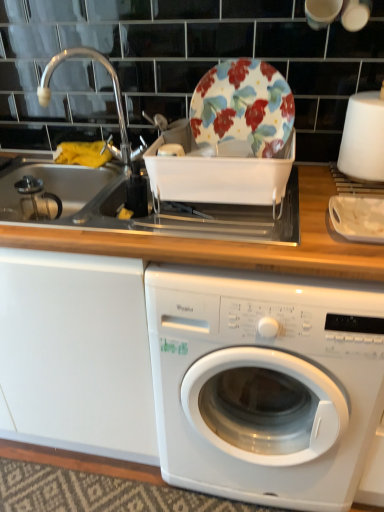
Question: Is brushed metal sink at left bigger than white glossy washing machine at center?

Choices:
 (A) yes
 (B) no

Answer: (B)

Question: From a real-world perspective, is brushed metal sink at left positioned over white glossy washing machine at center based on gravity?

Choices:
 (A) no
 (B) yes

Answer: (B)

Question: From the image's perspective, is brushed metal sink at left below white glossy washing machine at center?

Choices:
 (A) yes
 (B) no

Answer: (B)

Question: Would you say brushed metal sink at left contains white glossy washing machine at center?

Choices:
 (A) yes
 (B) no

Answer: (B)

Question: Considering the relative positions of brushed metal sink at left and white glossy washing machine at center in the image provided, is brushed metal sink at left to the left of white glossy washing machine at center from the viewer's perspective?

Choices:
 (A) no
 (B) yes

Answer: (B)

Question: Is the position of brushed metal sink at left less distant than that of white glossy washing machine at center?

Choices:
 (A) no
 (B) yes

Answer: (A)

Question: Is white plastic container at right smaller than white glossy washing machine at center?

Choices:
 (A) yes
 (B) no

Answer: (A)

Question: Can you confirm if white plastic container at right is positioned to the left of white glossy washing machine at center?

Choices:
 (A) no
 (B) yes

Answer: (A)

Question: Is white plastic container at right outside white glossy washing machine at center?

Choices:
 (A) yes
 (B) no

Answer: (A)

Question: Is white plastic container at right wider than white glossy washing machine at center?

Choices:
 (A) yes
 (B) no

Answer: (B)

Question: Does white plastic container at right appear on the right side of white glossy washing machine at center?

Choices:
 (A) yes
 (B) no

Answer: (A)

Question: Can you confirm if white plastic container at right is shorter than white glossy washing machine at center?

Choices:
 (A) no
 (B) yes

Answer: (B)

Question: Considering the relative positions of floral-patterned ceramic plate at upper center and white plastic container at right in the image provided, is floral-patterned ceramic plate at upper center in front of white plastic container at right?

Choices:
 (A) no
 (B) yes

Answer: (A)